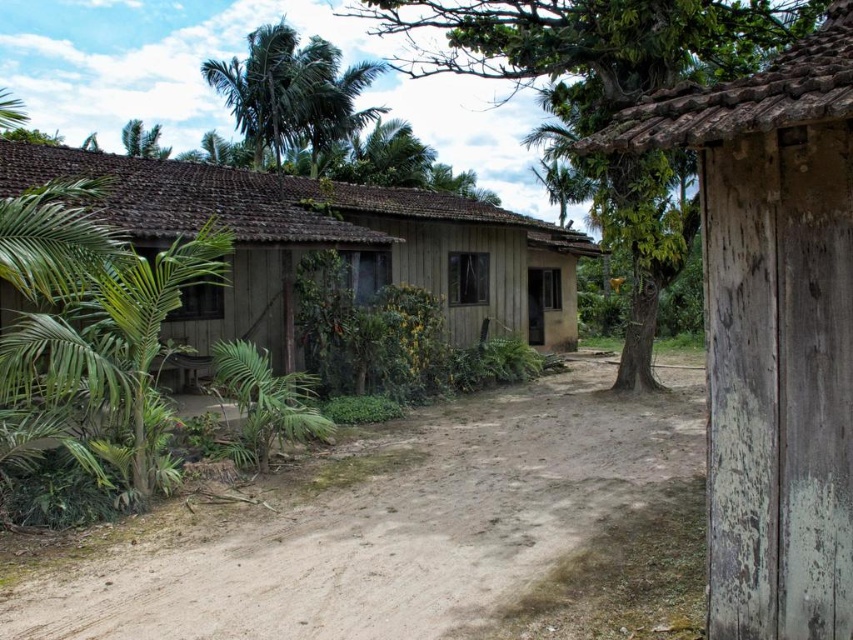
You are standing in the middle of the dirt path leading to the house and see two points marked in the scene. The first point is at coordinates point [480,401] and the second is at point [350,236]. Which point is closer to you?

Point [480,401] is closer to you because it is further to the viewer than point [350,236].

You are standing in front of the wooden house and want to walk to both the point at (688, 420) and the point at (318, 131). Which point will you reach first?

You will reach the point at (688, 420) first because it is closer to you than the point at (318, 131).